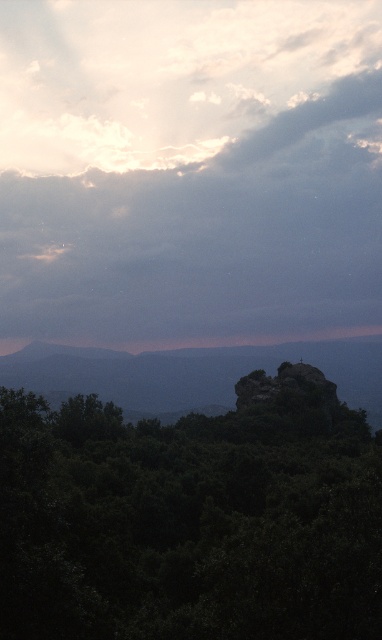
Question: Can you confirm if cloudy sky at upper center is wider than green leafy tree at center?

Choices:
 (A) no
 (B) yes

Answer: (B)

Question: Among these objects, which one is farthest from the camera?

Choices:
 (A) rugged stone peak at center
 (B) green leafy tree at center
 (C) cloudy sky at upper center

Answer: (C)

Question: Is green leafy tree at center closer to camera compared to rugged stone peak at center?

Choices:
 (A) yes
 (B) no

Answer: (A)

Question: Which point is farther from the camera taking this photo?

Choices:
 (A) (113, 230)
 (B) (346, 589)
 (C) (294, 394)

Answer: (A)

Question: Which point is farther from the camera taking this photo?

Choices:
 (A) (302, 362)
 (B) (231, 499)
 (C) (322, 282)

Answer: (C)

Question: Is cloudy sky at upper center positioned in front of green leafy tree at center?

Choices:
 (A) yes
 (B) no

Answer: (B)